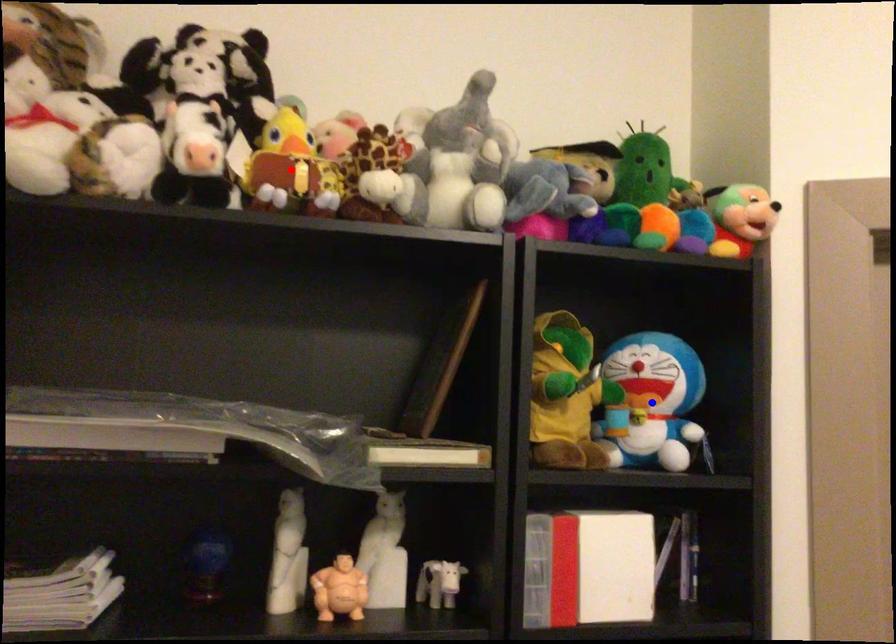
Question: In the image, two points are highlighted. Which point is nearer to the camera? Reply with the corresponding letter.

Choices:
 (A) blue point
 (B) red point

Answer: (B)